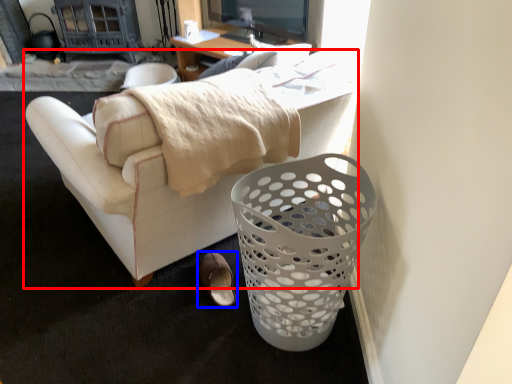
Question: Which object appears closest to the camera in this image, studio couch (highlighted by a red box) or footwear (highlighted by a blue box)?

Choices:
 (A) studio couch
 (B) footwear

Answer: (A)